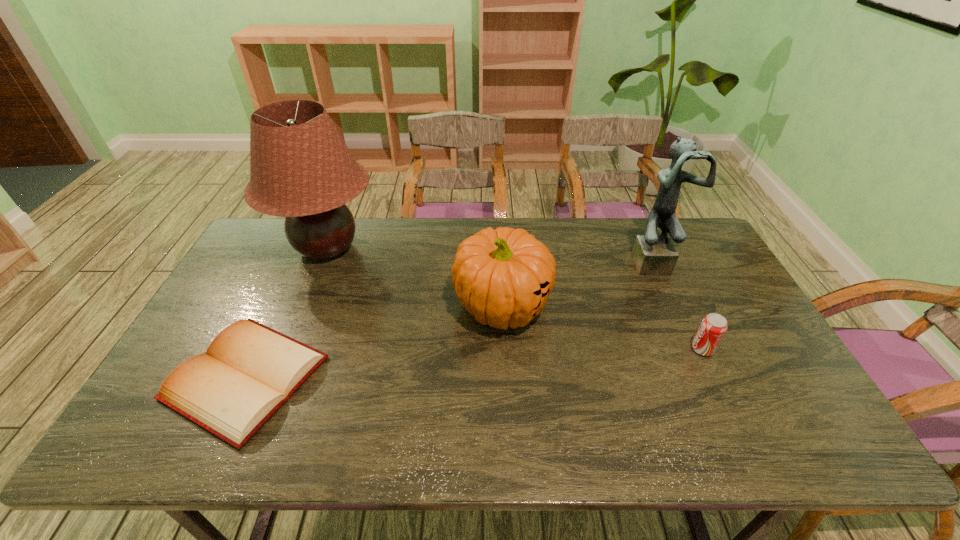
Where is `blank area located on the logo side of the fourth tallest object`? Image resolution: width=960 pixels, height=540 pixels. blank area located on the logo side of the fourth tallest object is located at coordinates (580, 349).

I want to click on vacant space located 0.270m on the logo side of the fourth tallest object, so click(x=591, y=349).

Locate an element on the screen. Image resolution: width=960 pixels, height=540 pixels. free location located on the back of the shortest object is located at coordinates (x=288, y=287).

In order to click on lampshade at the far edge in this screenshot , I will do `click(300, 168)`.

Where is `sculpture at the far edge`? sculpture at the far edge is located at coordinates (653, 254).

Identify the location of object situated at the near edge. (249, 371).

The width and height of the screenshot is (960, 540). Identify the location of lampshade present at the left edge. [x=300, y=168].

Locate an element on the screen. Image resolution: width=960 pixels, height=540 pixels. Bible that is positioned at the left edge is located at coordinates tap(249, 371).

Where is `sculpture present at the right edge`? The height and width of the screenshot is (540, 960). sculpture present at the right edge is located at coordinates (653, 254).

At what (x,y) coordinates should I click in order to perform the action: click on soda can that is at the right edge. Please return your answer as a coordinate pair (x, y). This screenshot has width=960, height=540. Looking at the image, I should click on (713, 326).